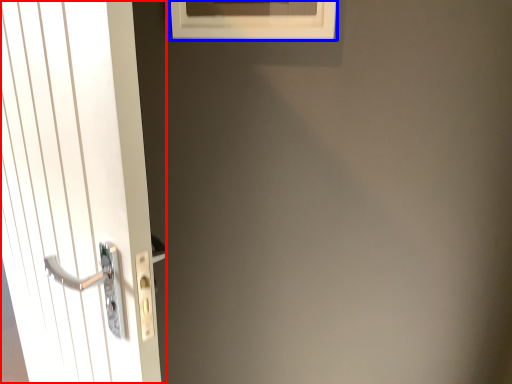
Question: Among these objects, which one is farthest to the camera, door (highlighted by a red box) or window (highlighted by a blue box)?

Choices:
 (A) door
 (B) window

Answer: (B)